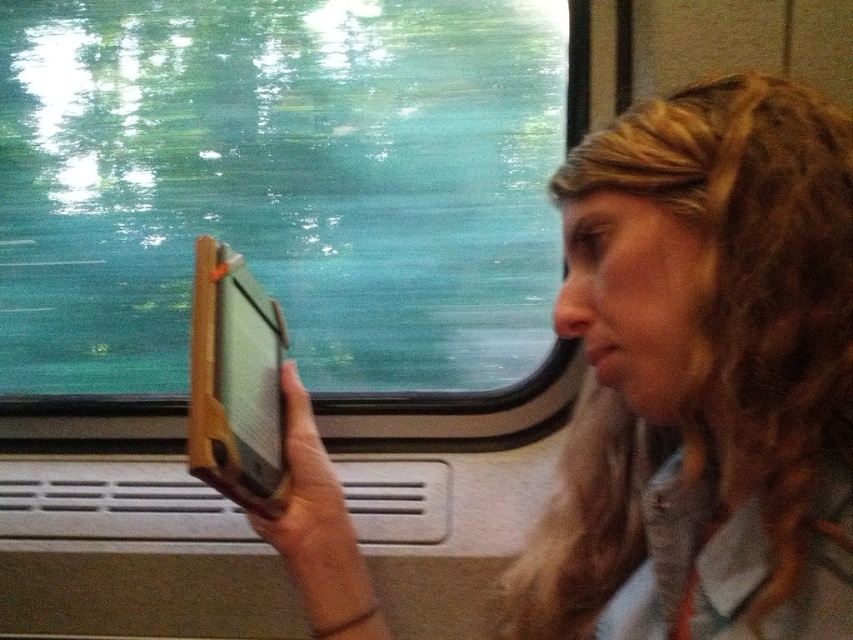
Question: Is matte black tablet at center to the right of wooden tablet at center from the viewer's perspective?

Choices:
 (A) no
 (B) yes

Answer: (B)

Question: Among these objects, which one is farthest from the camera?

Choices:
 (A) transparent glass train window at center
 (B) matte black tablet at center

Answer: (A)

Question: Which point is closer to the camera?

Choices:
 (A) (236, 493)
 (B) (688, 180)
 (C) (21, 326)

Answer: (B)

Question: Which object is closer to the camera taking this photo?

Choices:
 (A) matte black tablet at center
 (B) wooden tablet at center
 (C) transparent glass train window at center

Answer: (A)

Question: Is transparent glass train window at center positioned at the back of wooden tablet at center?

Choices:
 (A) yes
 (B) no

Answer: (A)

Question: Is transparent glass train window at center closer to the viewer compared to wooden tablet at center?

Choices:
 (A) yes
 (B) no

Answer: (B)